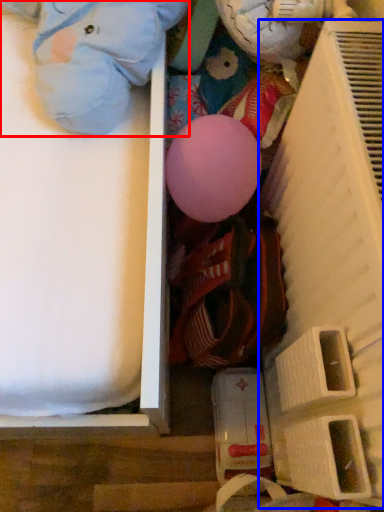
Question: Among these objects, which one is farthest to the camera, toy (highlighted by a red box) or shelf (highlighted by a blue box)?

Choices:
 (A) toy
 (B) shelf

Answer: (A)